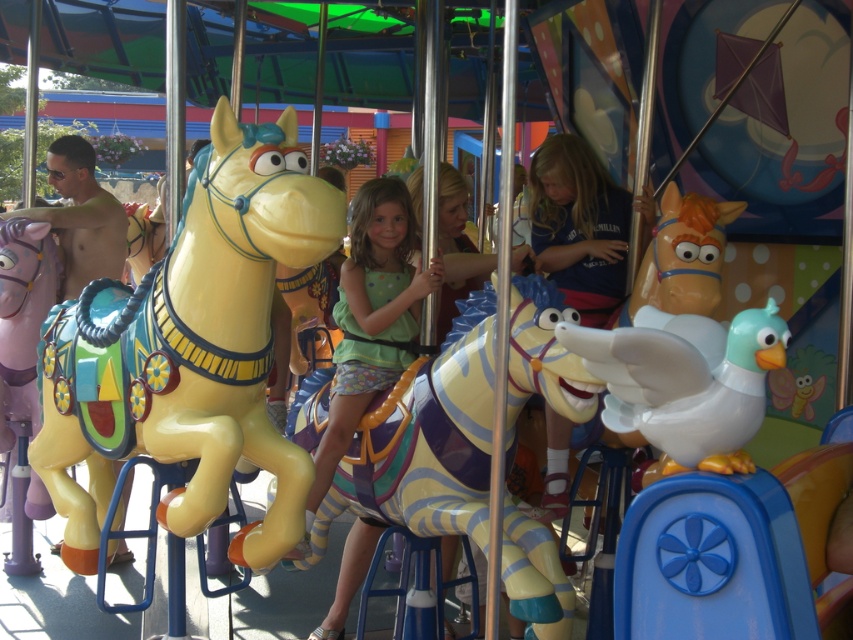
Between point (109, 349) and point (395, 180), which one is positioned behind?

The point (395, 180) is behind.

Which of these two, glossy yellow horse at left or matte green dress at center, stands shorter?

With less height is matte green dress at center.

Is point (85, 429) positioned in front of point (408, 232)?

Yes, it is in front of point (408, 232).

Locate an element on the screen. glossy yellow horse at left is located at coordinates (189, 349).

Is point (323, 435) in front of point (99, 195)?

Yes, point (323, 435) is in front of point (99, 195).

Identify the location of matte green dress at center. [370, 323].

Is glossy yellow horse at left wider than shiny gold helmet at left?

Yes.

Locate an element on the screen. This screenshot has width=853, height=640. glossy yellow horse at left is located at coordinates (189, 349).

Between point (91, 397) and point (78, 200), which one is positioned behind?

Positioned behind is point (78, 200).

Identify the location of glossy yellow horse at left. (189, 349).